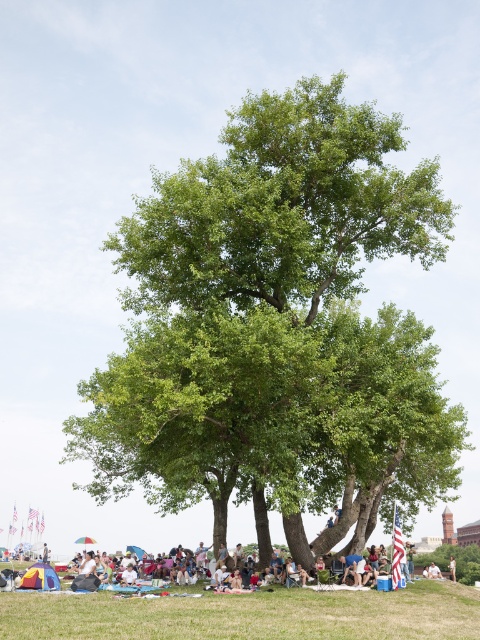
Is green leafy tree at center behind light brown wooden stick at center?

No.

Does green leafy tree at center appear over light brown wooden stick at center?

Yes, green leafy tree at center is above light brown wooden stick at center.

Where is `green leafy tree at center`? Image resolution: width=480 pixels, height=640 pixels. green leafy tree at center is located at coordinates (276, 326).

Find the location of `green leafy tree at center`. green leafy tree at center is located at coordinates (276, 326).

Does green leafy tree at center have a larger size compared to green grassy field at lower center?

Yes.

Which is in front, point (280, 304) or point (120, 636)?

Point (120, 636) is in front.

Locate an element on the screen. green leafy tree at center is located at coordinates (276, 326).

Based on the photo, is green grassy field at lower center positioned in front of light brown wooden stick at center?

Yes, green grassy field at lower center is in front of light brown wooden stick at center.

In the scene shown: Which is above, green grassy field at lower center or light brown wooden stick at center?

green grassy field at lower center

Which is in front, point (260, 632) or point (451, 566)?

Point (260, 632)

Locate an element on the screen. The width and height of the screenshot is (480, 640). green grassy field at lower center is located at coordinates (248, 614).